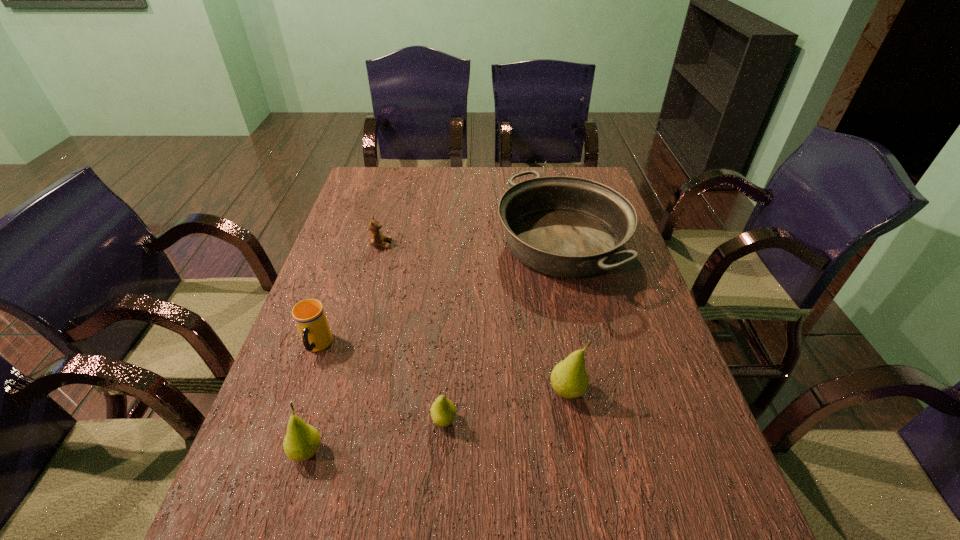
Where is `object that is at the right edge`? object that is at the right edge is located at coordinates (562, 226).

This screenshot has height=540, width=960. Find the location of `object that is at the near left corner`. object that is at the near left corner is located at coordinates (301, 442).

The height and width of the screenshot is (540, 960). I want to click on object that is positioned at the far right corner, so click(x=562, y=226).

The width and height of the screenshot is (960, 540). What are the coordinates of `free spot at the far edge of the desktop` in the screenshot? It's located at (485, 183).

The height and width of the screenshot is (540, 960). I want to click on vacant region at the near edge of the desktop, so click(617, 470).

This screenshot has height=540, width=960. What are the coordinates of `vacant region at the left edge of the desktop` in the screenshot? It's located at (326, 278).

This screenshot has width=960, height=540. Find the location of `vacant region at the right edge of the desktop`. vacant region at the right edge of the desktop is located at coordinates (632, 249).

You are a GUI agent. You are given a task and a screenshot of the screen. Output one action in this format:
    pyautogui.click(x=<x>, y=<y>)
    Task: Click on the free location at the far left corner
    The image size is (960, 540).
    Given the screenshot: What is the action you would take?
    pyautogui.click(x=374, y=173)

In the image, there is a desktop. At what (x,y) coordinates should I click in order to perform the action: click on free space at the near right corner. Please return your answer as a coordinate pair (x, y). Looking at the image, I should click on (641, 458).

Image resolution: width=960 pixels, height=540 pixels. I want to click on vacant space that's between the cup and the tallest pear, so click(x=442, y=369).